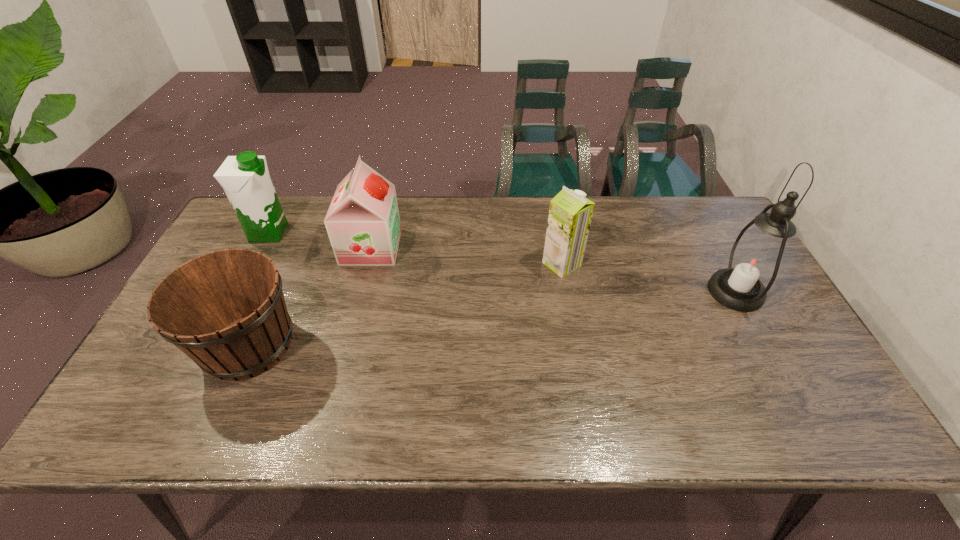
This screenshot has width=960, height=540. Find the location of `oil lamp`. oil lamp is located at coordinates (755, 261).

This screenshot has width=960, height=540. Find the location of `the rightmost object`. the rightmost object is located at coordinates (755, 261).

Find the location of a particular element. the leftmost soya milk is located at coordinates (245, 178).

The width and height of the screenshot is (960, 540). I want to click on the third object from left to right, so click(363, 224).

The image size is (960, 540). Identify the location of the fourth object from left to right. (570, 214).

Image resolution: width=960 pixels, height=540 pixels. I want to click on the shortest object, so click(225, 310).

I want to click on vacant space located 0.320m on the front of the tallest object, so click(812, 434).

Image resolution: width=960 pixels, height=540 pixels. In order to click on vacant point located 0.310m on the front-facing side of the leftmost soya milk in this screenshot , I will do `click(384, 233)`.

This screenshot has width=960, height=540. What are the coordinates of `free space located 0.290m with the cap open on the third object from left to right` in the screenshot? It's located at (491, 247).

The image size is (960, 540). In order to click on vacant space located on the left of the rightmost soya milk in this screenshot , I will do (x=446, y=264).